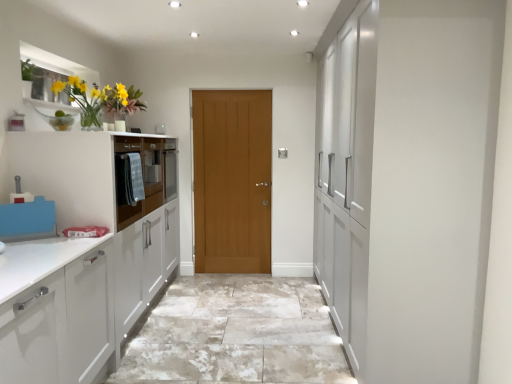
This screenshot has width=512, height=384. What are the coordinates of `vacant space underneath light brown wooden door at center (from a real-world perspective)` in the screenshot? It's located at (225, 274).